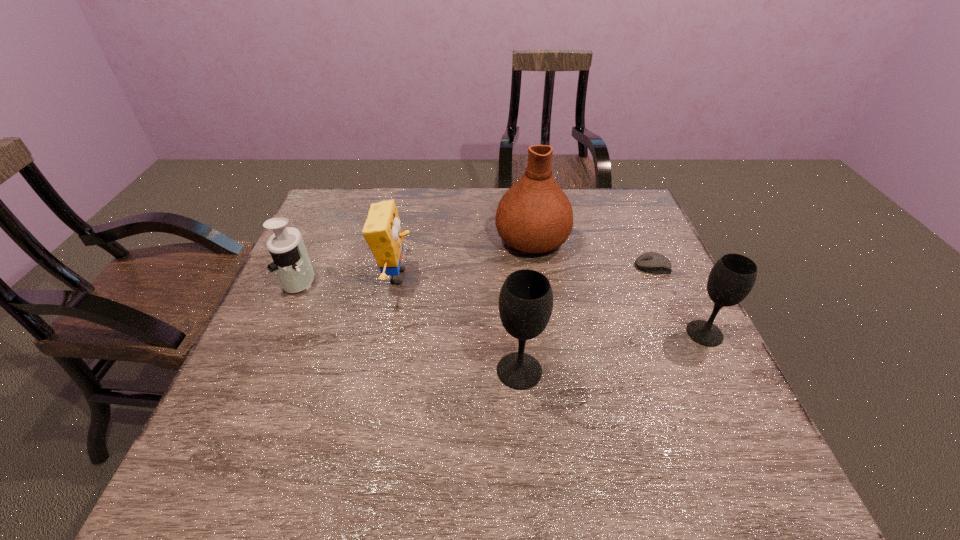
Considering the uniform spacing of wineglasss, where should an additional wineglass be positioned on the left? Please locate a free spot. Please provide its 2D coordinates. Your answer should be formatted as a tuple, i.e. [(x, y)], where the tuple contains the x and y coordinates of a point satisfying the conditions above.

[(300, 415)]